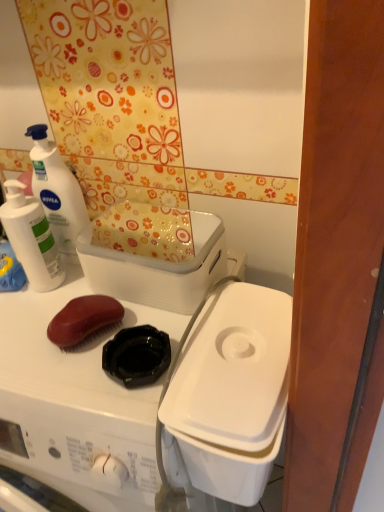
How much space does white plastic container at upper center, which is the first appliance in top-to-bottom order, occupy horizontally?

white plastic container at upper center, which is the first appliance in top-to-bottom order, is 11.06 centimeters wide.

In order to click on white matte lotion at upper left, the first cleaning product from the left in this screenshot , I will do `click(31, 238)`.

The image size is (384, 512). I want to click on white matte lotion at upper left, the second cleaning product viewed from the left, so click(57, 192).

From a real-world perspective, is white plastic container at upper center, which is the 2th appliance in bottom-to-top order, above or below white plastic washing machine at upper left?

Clearly, from a real-world perspective, white plastic container at upper center, which is the 2th appliance in bottom-to-top order, is above white plastic washing machine at upper left.

In the scene shown: Which of these two, white plastic container at upper center, which is the 2th appliance in bottom-to-top order, or white plastic washing machine at upper left, is bigger?

Bigger between the two is white plastic washing machine at upper left.

Does point (179, 294) appear closer or farther from the camera than point (13, 444)?

Point (179, 294).

Considering the sizes of objects white plastic container at upper center, which is the 2th appliance in bottom-to-top order, and white plastic washing machine at upper left in the image provided, who is shorter, white plastic container at upper center, which is the 2th appliance in bottom-to-top order, or white plastic washing machine at upper left?

Standing shorter between the two is white plastic container at upper center, which is the 2th appliance in bottom-to-top order.

Can you tell me how much white plastic container at center-right, which is counted as the 2th appliance, starting from the top, and white plastic washing machine at upper left differ in facing direction?

There is a 89.6-degree angle between the facing directions of white plastic container at center-right, which is counted as the 2th appliance, starting from the top, and white plastic washing machine at upper left.

Which is more to the left, white plastic container at center-right, which is counted as the 2th appliance, starting from the top, or white plastic washing machine at upper left?

white plastic washing machine at upper left is more to the left.

Is white plastic container at center-right, which is counted as the 2th appliance, starting from the top, facing towards white plastic washing machine at upper left?

Yes.

Is point (272, 450) farther from viewer compared to point (38, 456)?

That is False.

How distant is white plastic container at upper center, which is the first appliance in top-to-bottom order, from white plastic container at center-right, the 1th appliance when ordered from bottom to top?

A distance of 5.46 inches exists between white plastic container at upper center, which is the first appliance in top-to-bottom order, and white plastic container at center-right, the 1th appliance when ordered from bottom to top.

From a real-world perspective, is white plastic container at upper center, which is the first appliance in top-to-bottom order, on top of white plastic container at center-right, the 1th appliance when ordered from bottom to top?

Indeed, from a real-world perspective, white plastic container at upper center, which is the first appliance in top-to-bottom order, stands above white plastic container at center-right, the 1th appliance when ordered from bottom to top.

Considering the points (192, 296) and (266, 415), which point is behind, point (192, 296) or point (266, 415)?

The point (192, 296) is more distant.

Considering the sizes of objects white plastic container at upper center, which is the first appliance in top-to-bottom order, and white plastic container at center-right, the 1th appliance when ordered from bottom to top, in the image provided, who is thinner, white plastic container at upper center, which is the first appliance in top-to-bottom order, or white plastic container at center-right, the 1th appliance when ordered from bottom to top,?

white plastic container at upper center, which is the first appliance in top-to-bottom order, is thinner.

Which of these two, white matte lotion at upper left, the first cleaning product from the left, or white matte lotion at upper left, which appears as the 1th cleaning product when viewed from the right, is wider?

Wider between the two is white matte lotion at upper left, the first cleaning product from the left.

Considering the sizes of objects white matte lotion at upper left, acting as the 2th cleaning product starting from the right, and white matte lotion at upper left, which appears as the 1th cleaning product when viewed from the right, in the image provided, who is taller, white matte lotion at upper left, acting as the 2th cleaning product starting from the right, or white matte lotion at upper left, which appears as the 1th cleaning product when viewed from the right,?

With more height is white matte lotion at upper left, which appears as the 1th cleaning product when viewed from the right.

Is the position of white matte lotion at upper left, the first cleaning product from the left, less distant than that of white matte lotion at upper left, the second cleaning product viewed from the left?

Yes, the depth of white matte lotion at upper left, the first cleaning product from the left, is less than that of white matte lotion at upper left, the second cleaning product viewed from the left.

You are a GUI agent. You are given a task and a screenshot of the screen. Output one action in this format:
    pyautogui.click(x=<x>, y=<y>)
    Task: Click on the cleaning product in front of the white matte lotion at upper left, which appears as the 1th cleaning product when viewed from the right
    This screenshot has width=384, height=512.
    Given the screenshot: What is the action you would take?
    pyautogui.click(x=31, y=238)

Is white plastic container at center-right, which is counted as the 2th appliance, starting from the top, beside white plastic container at upper center, which is the 2th appliance in bottom-to-top order?

No, white plastic container at center-right, which is counted as the 2th appliance, starting from the top, is not with white plastic container at upper center, which is the 2th appliance in bottom-to-top order.

From the picture: Which object is more forward, white plastic container at center-right, the 1th appliance when ordered from bottom to top, or white plastic container at upper center, which is the 2th appliance in bottom-to-top order?

white plastic container at center-right, the 1th appliance when ordered from bottom to top, is more forward.

Does white plastic container at center-right, the 1th appliance when ordered from bottom to top, have a smaller size compared to white plastic container at upper center, which is the first appliance in top-to-bottom order?

Actually, white plastic container at center-right, the 1th appliance when ordered from bottom to top, might be larger than white plastic container at upper center, which is the first appliance in top-to-bottom order.

Based on the photo, which point is more distant from viewer, (235,464) or (188,285)?

The point (188,285) is farther.

Is white plastic washing machine at upper left outside of white matte lotion at upper left, the first cleaning product from the left?

That's correct, white plastic washing machine at upper left is outside of white matte lotion at upper left, the first cleaning product from the left.

Considering the relative sizes of white plastic washing machine at upper left and white matte lotion at upper left, the first cleaning product from the left, in the image provided, is white plastic washing machine at upper left wider than white matte lotion at upper left, the first cleaning product from the left,?

Yes.

Considering the relative positions of white plastic washing machine at upper left and white matte lotion at upper left, the first cleaning product from the left, in the image provided, is white plastic washing machine at upper left to the left of white matte lotion at upper left, the first cleaning product from the left, from the viewer's perspective?

No, white plastic washing machine at upper left is not to the left of white matte lotion at upper left, the first cleaning product from the left.

From a real-world perspective, who is located lower, white plastic washing machine at upper left or white matte lotion at upper left, acting as the 2th cleaning product starting from the right?

white plastic washing machine at upper left is physically lower.

Is white matte lotion at upper left, the second cleaning product viewed from the left, positioned with its back to white plastic container at upper center, which is the 2th appliance in bottom-to-top order?

No, white matte lotion at upper left, the second cleaning product viewed from the left, is not facing away from white plastic container at upper center, which is the 2th appliance in bottom-to-top order.

From a real-world perspective, which cleaning product is the 2nd one above the white plastic container at upper center, which is the first appliance in top-to-bottom order? Please provide its 2D coordinates.

[(57, 192)]

In the scene shown: Considering their positions, is white matte lotion at upper left, which appears as the 1th cleaning product when viewed from the right, located in front of or behind white plastic container at upper center, which is the 2th appliance in bottom-to-top order?

Clearly, white matte lotion at upper left, which appears as the 1th cleaning product when viewed from the right, is behind white plastic container at upper center, which is the 2th appliance in bottom-to-top order.

From the white plastic washing machine at upper left, count 2nd appliances backward and point to it. Please provide its 2D coordinates.

[(158, 269)]

This screenshot has width=384, height=512. I want to click on appliance that is the 1st object located above the white plastic washing machine at upper left (from the image's perspective), so click(x=229, y=394).

Estimate the real-world distances between objects in this image. Which object is closer to white plastic container at upper center, which is the first appliance in top-to-bottom order, white plastic container at center-right, which is counted as the 2th appliance, starting from the top, or white matte lotion at upper left, acting as the 2th cleaning product starting from the right?

white plastic container at center-right, which is counted as the 2th appliance, starting from the top, is closer to white plastic container at upper center, which is the first appliance in top-to-bottom order.

Based on their spatial positions, is white matte lotion at upper left, the second cleaning product viewed from the left, or white plastic washing machine at upper left closer to white plastic container at center-right, the 1th appliance when ordered from bottom to top?

white plastic washing machine at upper left.

Looking at this image, from the image, which object appears to be nearer to white matte lotion at upper left, which appears as the 1th cleaning product when viewed from the right, white matte lotion at upper left, the first cleaning product from the left, or white plastic washing machine at upper left?

white matte lotion at upper left, the first cleaning product from the left, is closer to white matte lotion at upper left, which appears as the 1th cleaning product when viewed from the right.

Which object lies nearer to the anchor point white plastic container at upper center, which is the 2th appliance in bottom-to-top order, white plastic container at center-right, the 1th appliance when ordered from bottom to top, or white plastic washing machine at upper left?

white plastic container at center-right, the 1th appliance when ordered from bottom to top, is positioned closer to the anchor white plastic container at upper center, which is the 2th appliance in bottom-to-top order.

When comparing their distances from white matte lotion at upper left, the first cleaning product from the left, does white plastic container at center-right, the 1th appliance when ordered from bottom to top, or white plastic washing machine at upper left seem further?

white plastic container at center-right, the 1th appliance when ordered from bottom to top.

Estimate the real-world distances between objects in this image. Which object is closer to white plastic washing machine at upper left, white matte lotion at upper left, acting as the 2th cleaning product starting from the right, or white plastic container at upper center, which is the 2th appliance in bottom-to-top order?

white plastic container at upper center, which is the 2th appliance in bottom-to-top order, lies closer to white plastic washing machine at upper left than the other object.

Estimate the real-world distances between objects in this image. Which object is further from white matte lotion at upper left, the first cleaning product from the left, white plastic container at upper center, which is the 2th appliance in bottom-to-top order, or white matte lotion at upper left, which appears as the 1th cleaning product when viewed from the right?

white plastic container at upper center, which is the 2th appliance in bottom-to-top order, lies further to white matte lotion at upper left, the first cleaning product from the left, than the other object.

Looking at the image, which one is located further to white plastic container at upper center, which is the first appliance in top-to-bottom order, white matte lotion at upper left, which appears as the 1th cleaning product when viewed from the right, or white plastic container at center-right, the 1th appliance when ordered from bottom to top?

white matte lotion at upper left, which appears as the 1th cleaning product when viewed from the right, lies further to white plastic container at upper center, which is the first appliance in top-to-bottom order, than the other object.

Find the location of a particular element. This screenshot has height=512, width=384. appliance between white plastic container at upper center, which is the first appliance in top-to-bottom order, and white plastic washing machine at upper left vertically is located at coordinates (229, 394).

Identify the location of cleaning product between white matte lotion at upper left, the first cleaning product from the left, and white plastic container at upper center, which is the first appliance in top-to-bottom order, in the horizontal direction. (57, 192).

Identify the location of appliance between white matte lotion at upper left, the second cleaning product viewed from the left, and white plastic container at center-right, which is counted as the 2th appliance, starting from the top, from left to right. (158, 269).

This screenshot has height=512, width=384. Identify the location of appliance between white matte lotion at upper left, the first cleaning product from the left, and white plastic container at center-right, the 1th appliance when ordered from bottom to top. (158, 269).